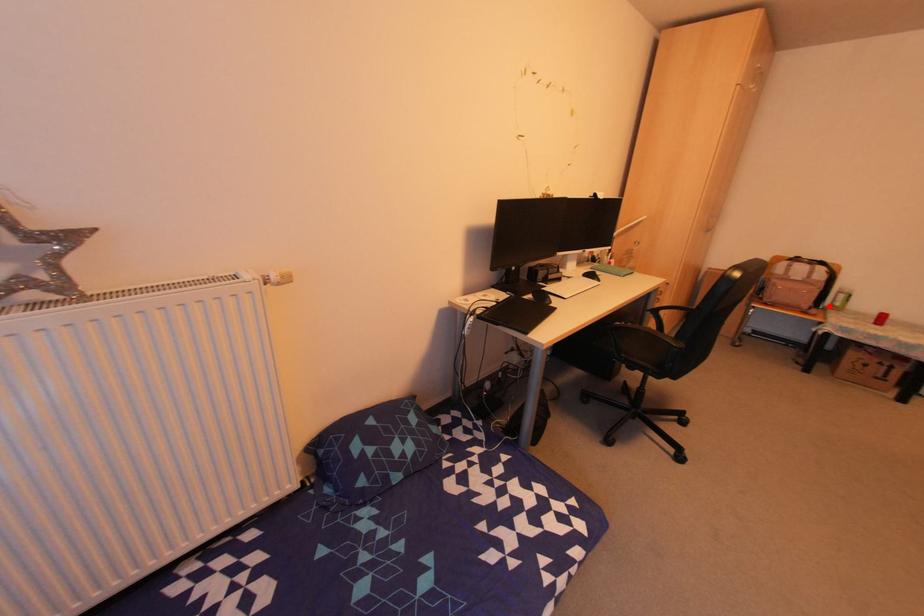
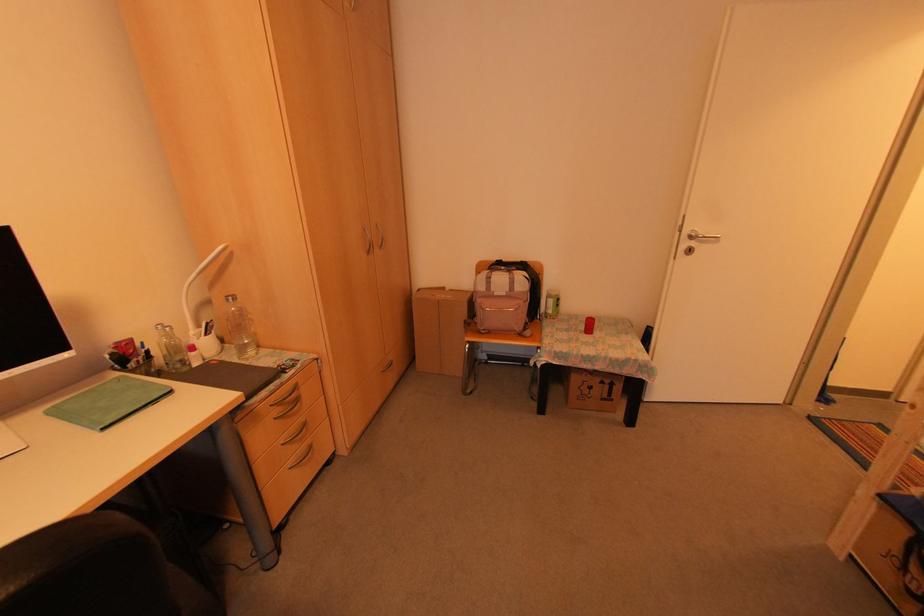
Find the pixel in the second image that matches the highlighted location in the first image.

(543, 314)